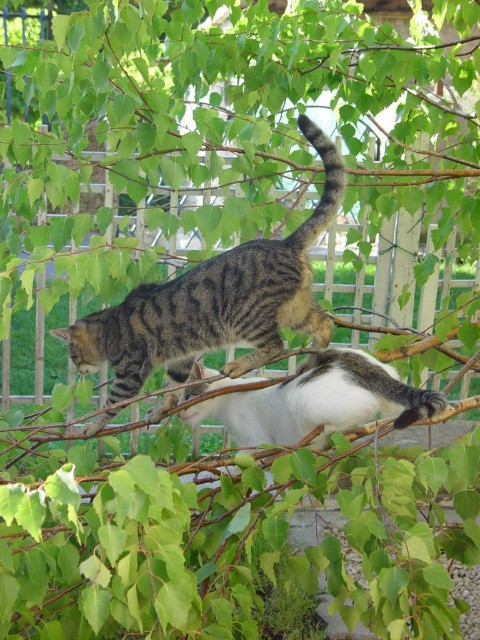
Based on the photo, which is below, tabby fur cat at center or white-gray fur cat at center?

white-gray fur cat at center is below.

Is point (207, 305) positioned after point (372, 364)?

No.

Does point (181, 301) come behind point (348, 406)?

Yes, point (181, 301) is farther from viewer.

Identify the location of tabby fur cat at center. (213, 305).